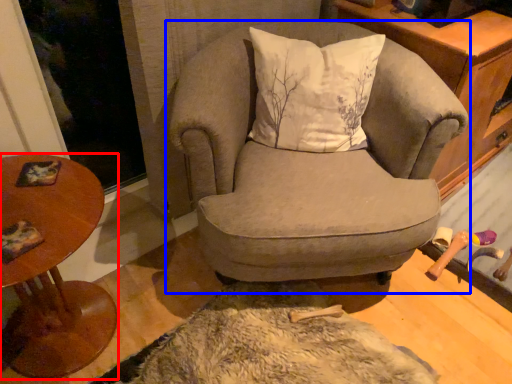
Question: Which point is closer to the camera, table (highlighted by a red box) or chair (highlighted by a blue box)?

Choices:
 (A) table
 (B) chair

Answer: (A)